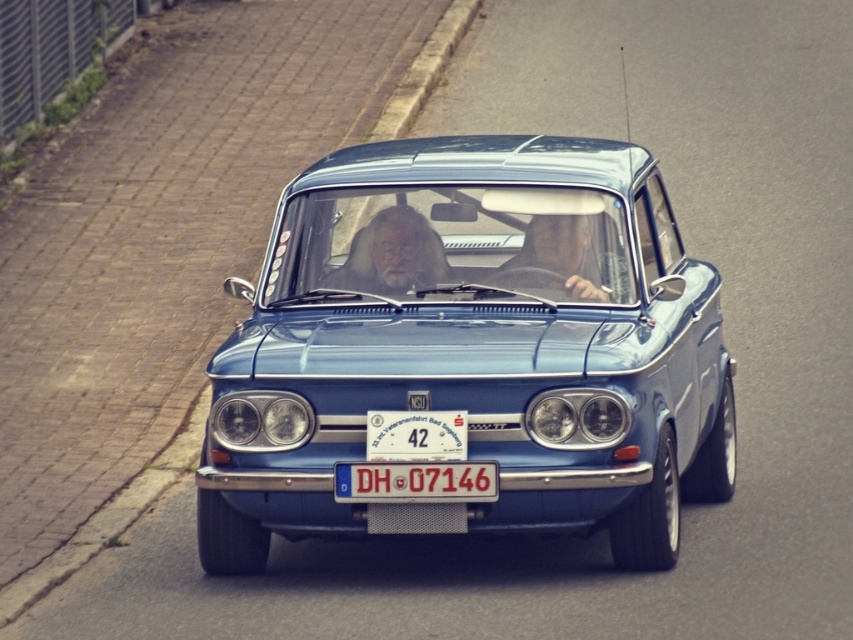
Question: Which point is closer to the camera taking this photo?

Choices:
 (A) (498, 163)
 (B) (561, 264)
 (C) (360, 259)
 (D) (368, 492)

Answer: (D)

Question: Does metallic blue car at center appear on the left side of gray hair and beard at center?

Choices:
 (A) yes
 (B) no

Answer: (B)

Question: Which point is farther from the camera taking this photo?

Choices:
 (A) (424, 340)
 (B) (564, 284)

Answer: (B)

Question: Is metallic blue car at center wider than smooth leather face at center?

Choices:
 (A) no
 (B) yes

Answer: (B)

Question: Which is nearer to the gray hair and beard at center?

Choices:
 (A) metallic blue car at center
 (B) white plastic license plate at center

Answer: (A)

Question: Does smooth leather face at center have a larger size compared to white plastic license plate at center?

Choices:
 (A) no
 (B) yes

Answer: (B)